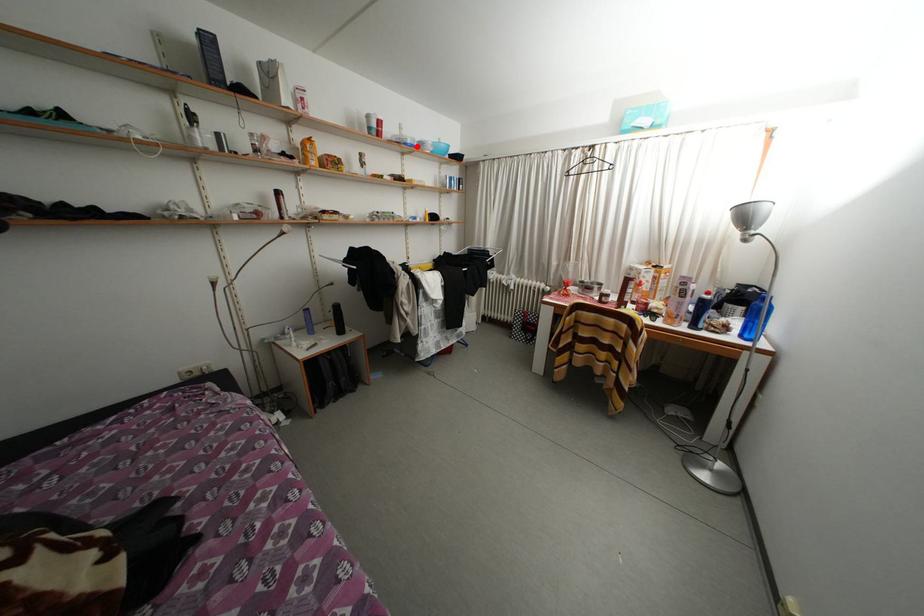
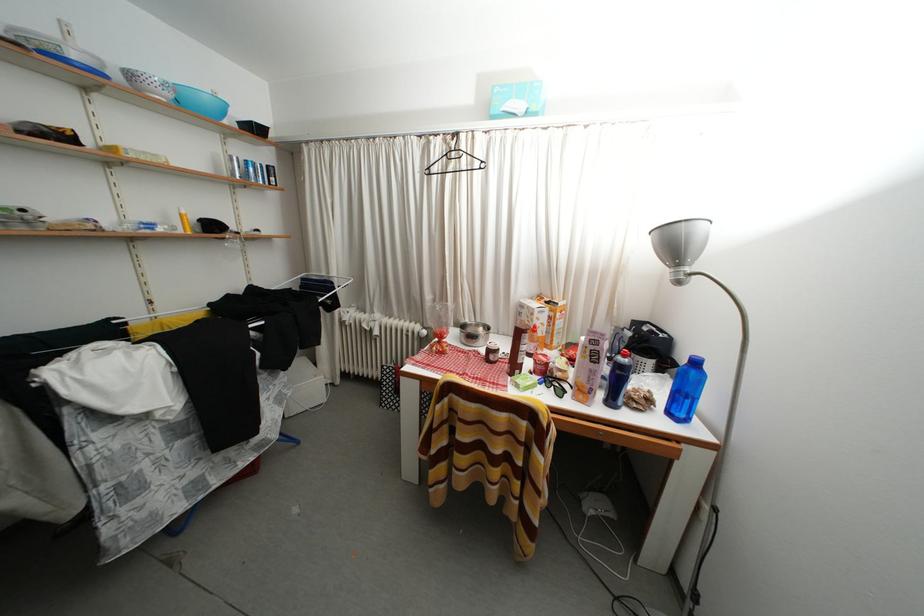
Question: A red point is marked in image1. In image2, is the corresponding 3D point closer to the camera or farther? Reply with the corresponding letter.

Choices:
 (A) The corresponding 3D point is closer.
 (B) The corresponding 3D point is farther.

Answer: (B)